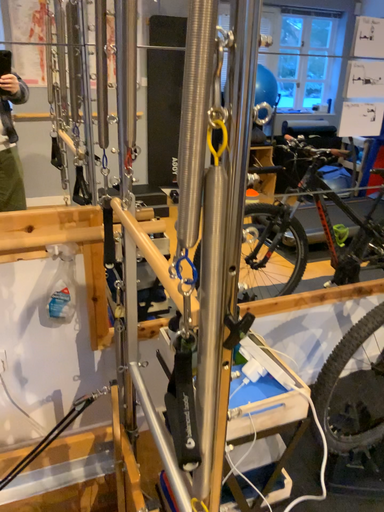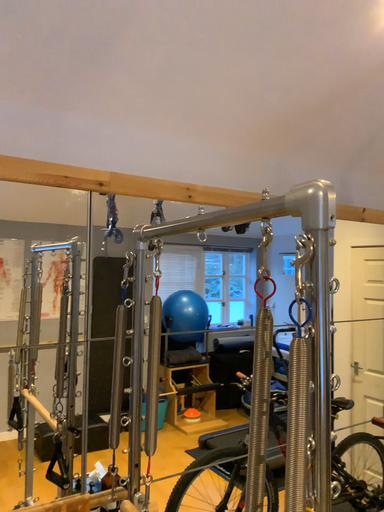
Question: Which way did the camera rotate in the video?

Choices:
 (A) rotated upward
 (B) rotated downward

Answer: (A)